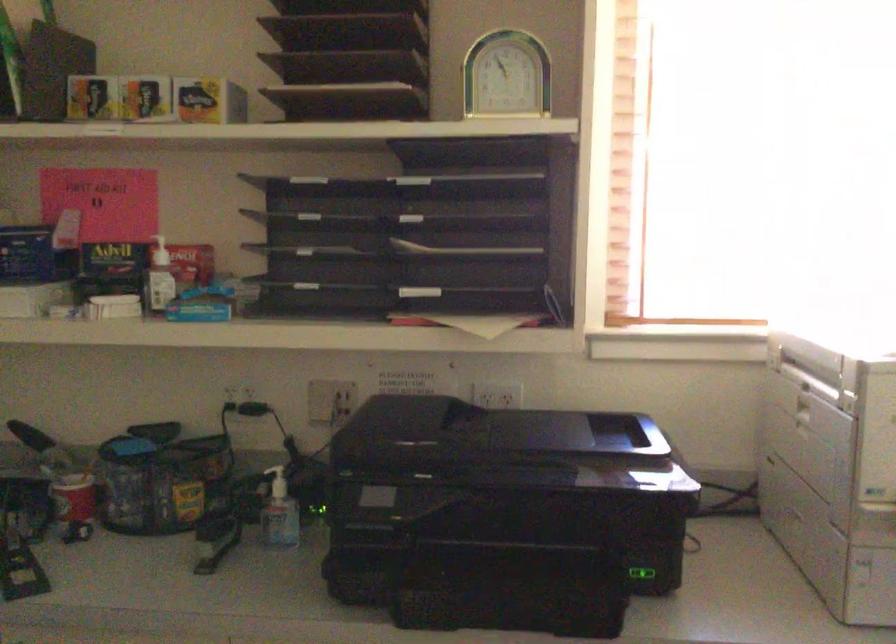
Question: The first image is from the beginning of the video and the second image is from the end. How did the camera likely rotate when shooting the video?

Choices:
 (A) Left
 (B) Right
 (C) Up
 (D) Down

Answer: (A)